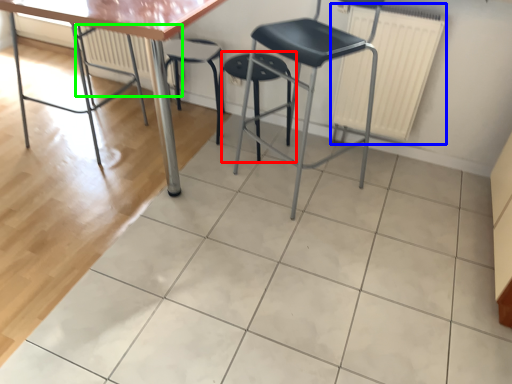
Question: Which object is the closest to the stool (highlighted by a red box)? Choose among these: radiator (highlighted by a blue box) or radiator (highlighted by a green box).

Choices:
 (A) radiator
 (B) radiator

Answer: (A)